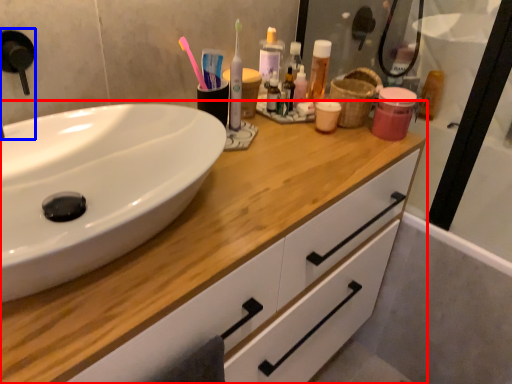
Question: Which object is closer to the camera taking this photo, bathroom cabinet (highlighted by a red box) or faucet (highlighted by a blue box)?

Choices:
 (A) bathroom cabinet
 (B) faucet

Answer: (A)